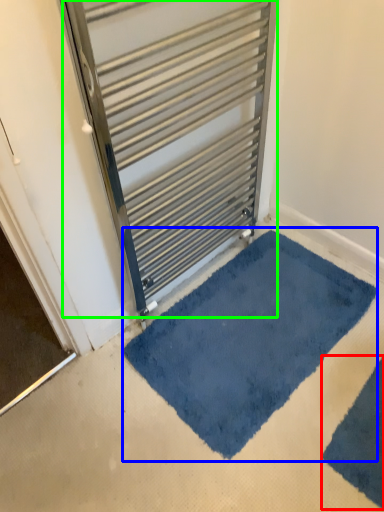
Question: Which is farther away from bath mat (highlighted by a red box)? bath mat (highlighted by a blue box) or door (highlighted by a green box)?

Choices:
 (A) bath mat
 (B) door

Answer: (B)